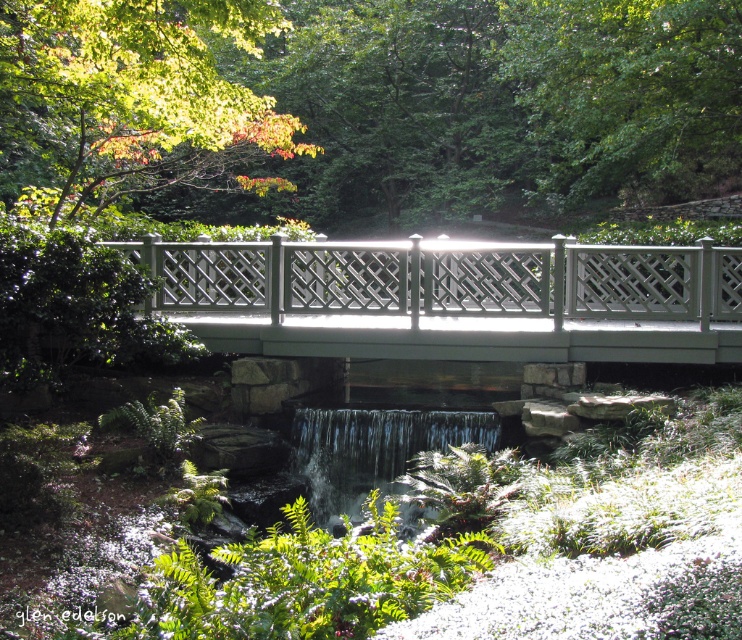
You are standing on the white lattice bridge at center in the garden. You want to cross to the other side. Is the clear glass waterfall at center directly in your path, or is it behind you?

The clear glass waterfall at center is behind the white lattice bridge at center, so it is not directly in your path. You can safely cross the bridge to the other side.

In the scene shown: You are a maintenance worker who needs to inspect the white lattice bridge at center and the clear glass waterfall at center. You have a 2.0 meter long inspection ladder. Can you safely place the ladder between the two structures to reach both for inspection?

The distance between the white lattice bridge at center and the clear glass waterfall at center is 1.91 meters. Since the ladder is 2.0 meters long, it is slightly longer than the gap. The ladder can be placed between them, but you should ensure it is positioned carefully to avoid overhang on either side, ensuring stability during inspection.